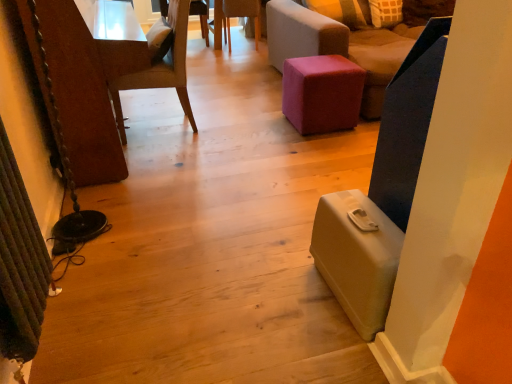
The width and height of the screenshot is (512, 384). I want to click on vacant area that lies between matte green suitcase at lower right and light brown wood chair at left, placed as the 2th chair when sorted from left to right, so 229,188.